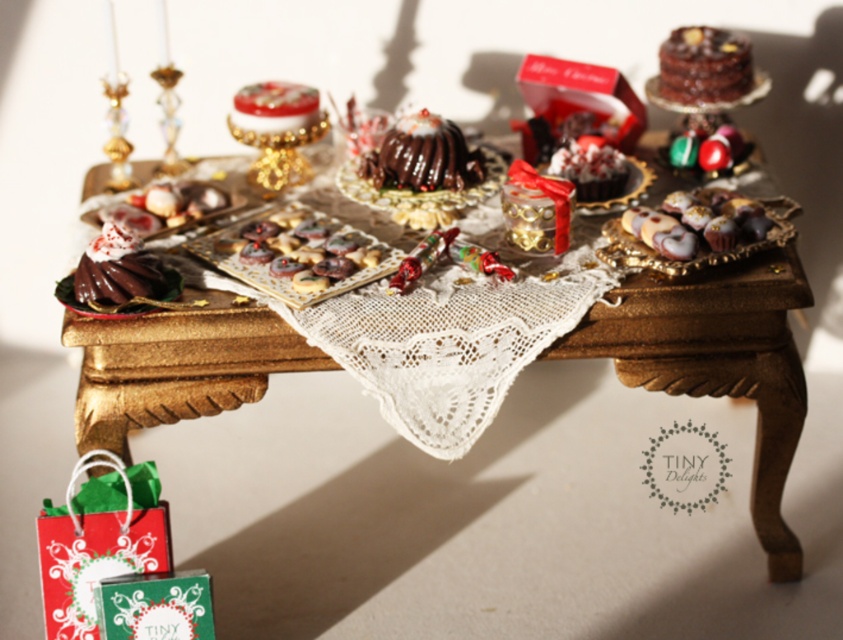
Question: Can you confirm if chocolate glossy cake at center is smaller than chocolate matte cupcake at center?

Choices:
 (A) yes
 (B) no

Answer: (A)

Question: Can you confirm if chocolate glossy cake at center is positioned to the right of chocolate matte cupcake at center?

Choices:
 (A) no
 (B) yes

Answer: (B)

Question: Which object is positioned closest to the chocolate glossy cake at center?

Choices:
 (A) shiny gold cake at center
 (B) red paper gift bag at lower left
 (C) gold lacquered table at center

Answer: (C)

Question: Can you confirm if shiny gold cake at center is positioned below chocolate matte cupcake at center?

Choices:
 (A) yes
 (B) no

Answer: (B)

Question: Which of the following is the farthest from the observer?

Choices:
 (A) (227, 116)
 (B) (583, 156)
 (C) (76, 509)

Answer: (A)

Question: Among these points, which one is nearest to the camera?

Choices:
 (A) pyautogui.click(x=156, y=552)
 (B) pyautogui.click(x=620, y=164)
 (C) pyautogui.click(x=779, y=358)
 (D) pyautogui.click(x=309, y=96)

Answer: (A)